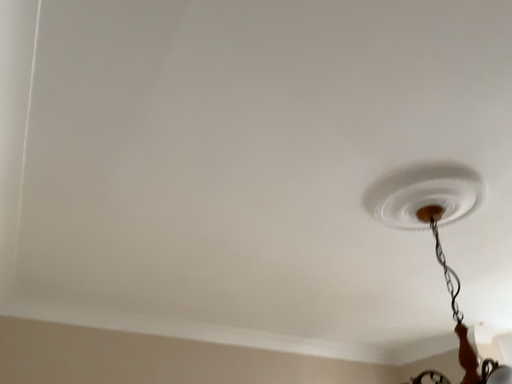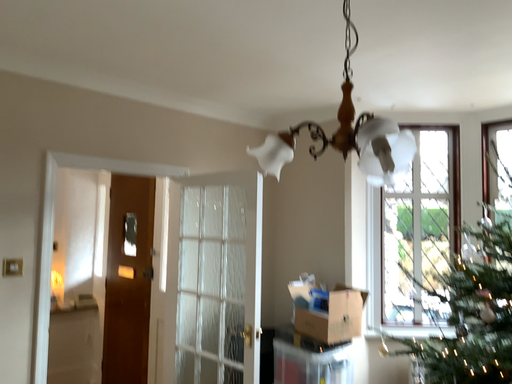
Question: Which way did the camera rotate in the video?

Choices:
 (A) rotated upward
 (B) rotated downward

Answer: (B)